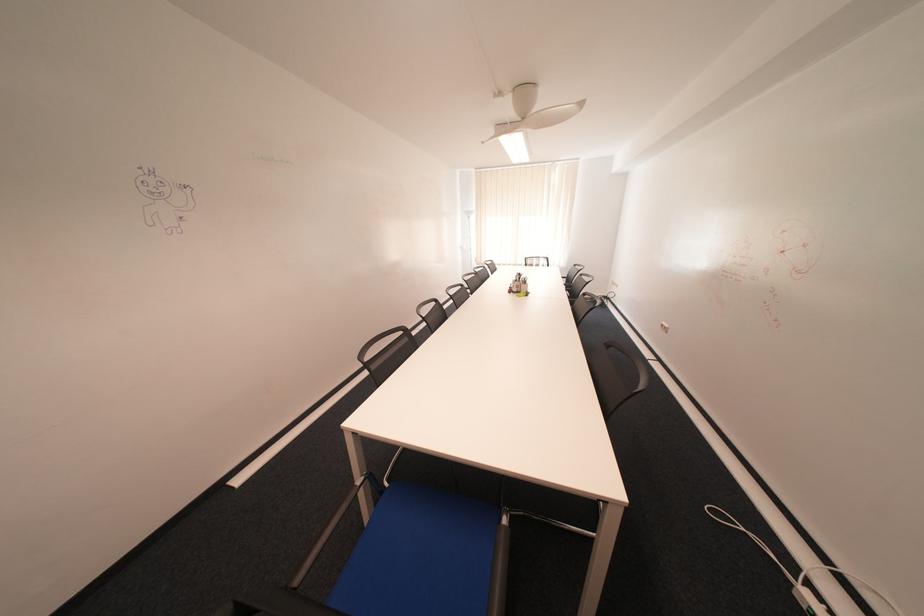
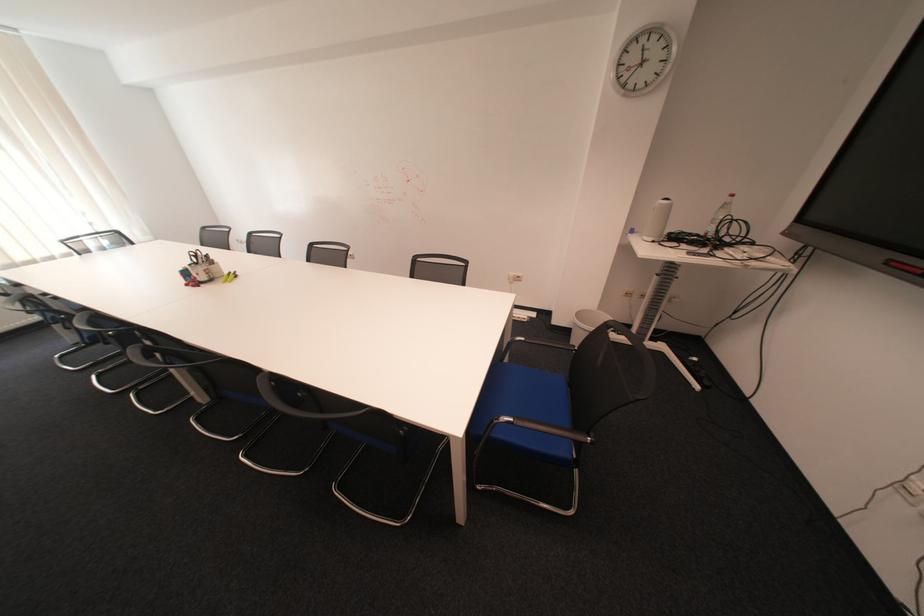
The point at (529, 293) is marked in the first image. Where is the corresponding point in the second image?

(223, 281)